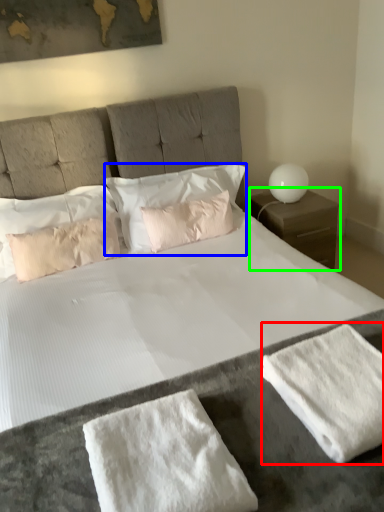
Question: Considering the real-world distances, which object is farthest from bath towel (highlighted by a red box)? pillow (highlighted by a blue box) or nightstand (highlighted by a green box)?

Choices:
 (A) pillow
 (B) nightstand

Answer: (B)